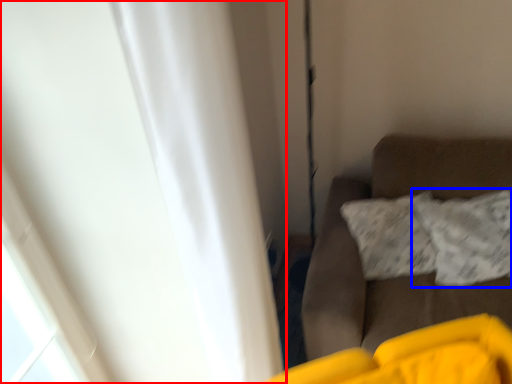
Question: Which point is closer to the camera, curtain (highlighted by a red box) or pillow (highlighted by a blue box)?

Choices:
 (A) curtain
 (B) pillow

Answer: (A)